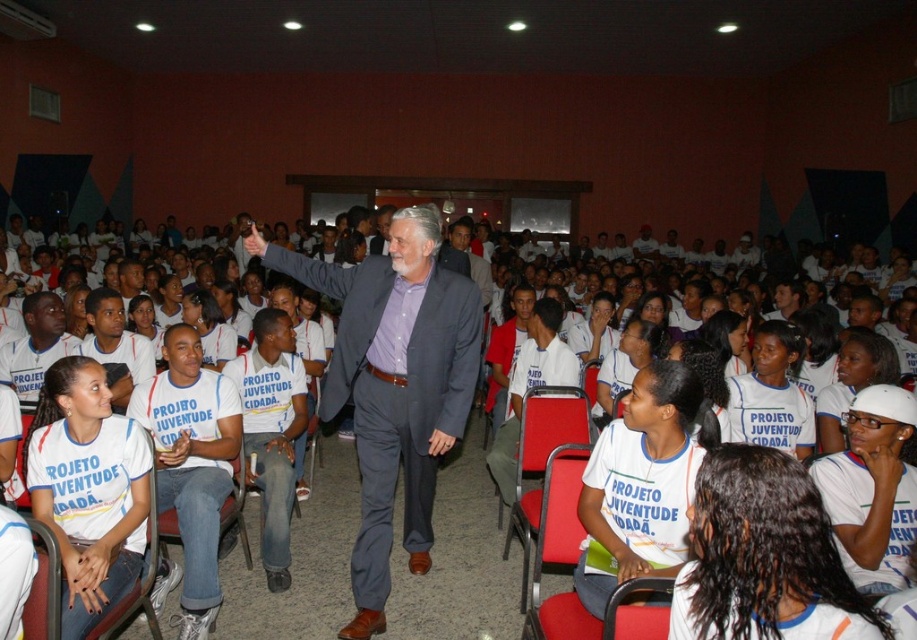
Does point (426, 438) come closer to viewer compared to point (583, 428)?

Yes, it is in front of point (583, 428).

Does gray suit at center have a greater width compared to red fabric chair at center?

Yes.

Locate an element on the screen. This screenshot has width=917, height=640. gray suit at center is located at coordinates (394, 387).

In the scene shown: Which of these two, red fabric chair at lower center or red fabric chair at center, stands taller?

red fabric chair at center is taller.

Does red fabric chair at lower center have a greater height compared to red fabric chair at center?

No.

Is point (543, 483) positioned behind point (538, 412)?

No.

In order to click on red fabric chair at lower center in this screenshot , I will do `click(560, 552)`.

Is white t-shirt at center smaller than red fabric chair at center?

Yes, white t-shirt at center is smaller than red fabric chair at center.

Is white t-shirt at center to the left of red fabric chair at center from the viewer's perspective?

No, white t-shirt at center is not to the left of red fabric chair at center.

Who is more forward, (760, 451) or (571, 432)?

Point (760, 451) is more forward.

This screenshot has width=917, height=640. I want to click on white t-shirt at center, so click(764, 556).